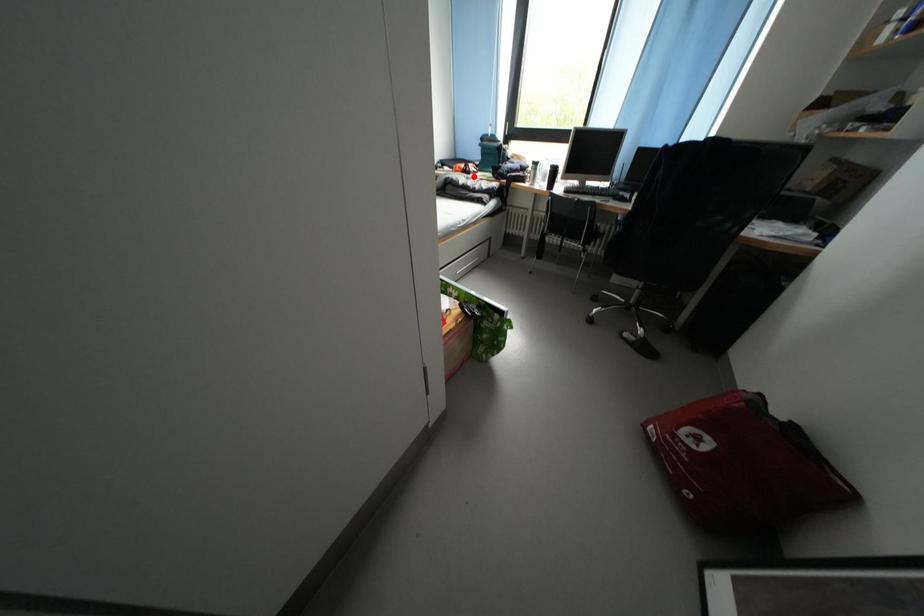
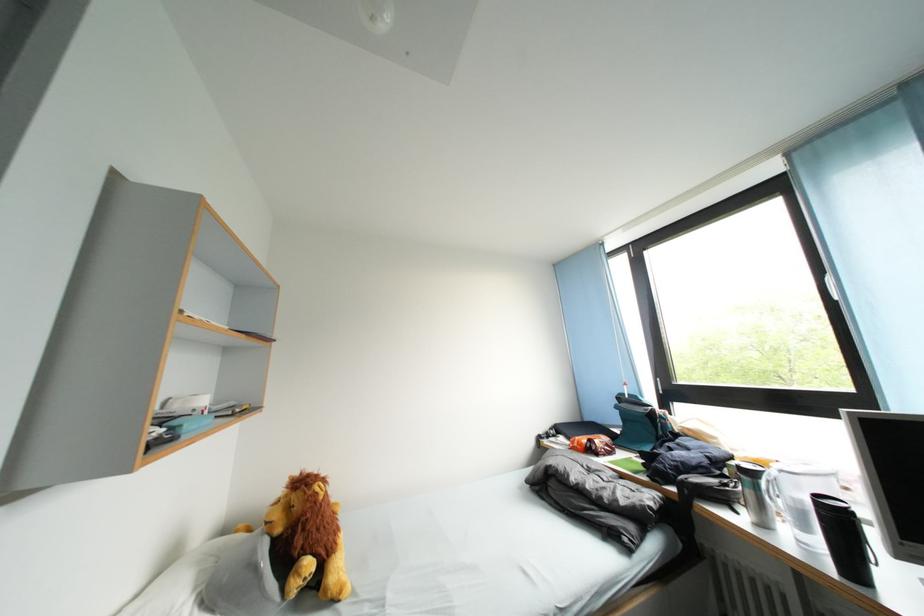
Question: I am providing you with two images of the same scene from different viewpoints. A red point is marked on the first image. Can you still see the location of the red point in image 2?

Choices:
 (A) Yes
 (B) No

Answer: (A)